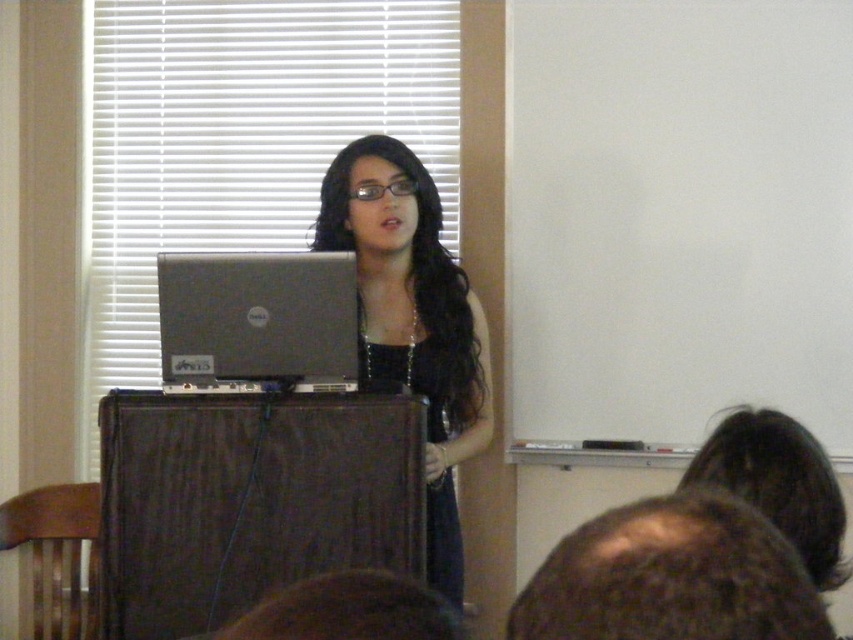
Which is below, matte black dress at center or brown fuzzy hair at lower right?

brown fuzzy hair at lower right is lower down.

Between matte black dress at center and brown fuzzy hair at lower right, which one is positioned higher?

matte black dress at center is higher up.

Identify the location of matte black dress at center. The width and height of the screenshot is (853, 640). (413, 320).

How much distance is there between brown fuzzy hair at lower right and silver metallic laptop at center?

brown fuzzy hair at lower right is 4.11 feet from silver metallic laptop at center.

Who is taller, brown fuzzy hair at lower right or silver metallic laptop at center?

silver metallic laptop at center is taller.

Which is behind, point (759, 600) or point (165, 372)?

The point (165, 372) is more distant.

Identify the location of brown fuzzy hair at lower right. Image resolution: width=853 pixels, height=640 pixels. (671, 577).

Based on the photo, which is below, matte black dress at center or silver metallic laptop at center?

matte black dress at center

Between matte black dress at center and silver metallic laptop at center, which one appears on the left side from the viewer's perspective?

From the viewer's perspective, silver metallic laptop at center appears more on the left side.

What do you see at coordinates (413, 320) in the screenshot? Image resolution: width=853 pixels, height=640 pixels. I see `matte black dress at center` at bounding box center [413, 320].

At what (x,y) coordinates should I click in order to perform the action: click on matte black dress at center. Please return your answer as a coordinate pair (x, y). Looking at the image, I should click on (413, 320).